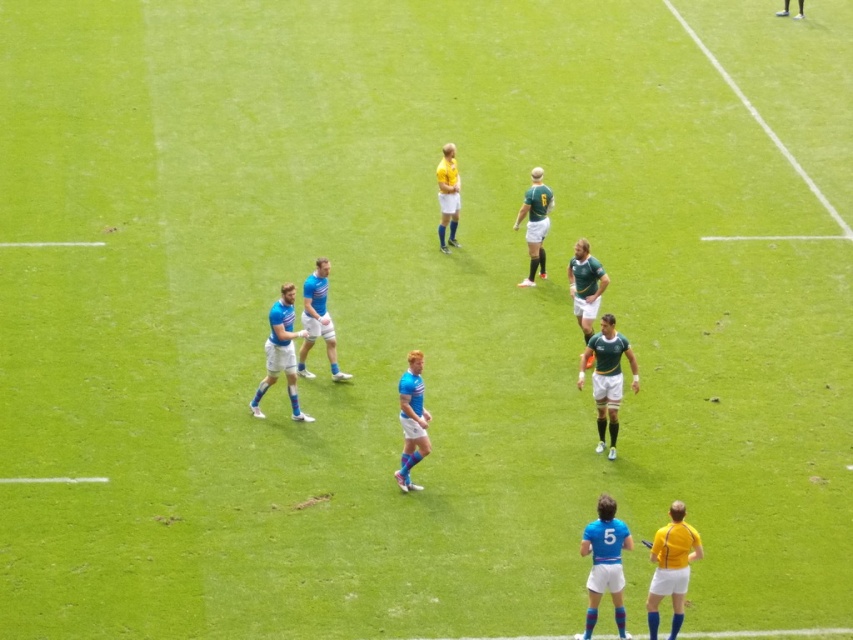
Where is `green grass at upper right`? green grass at upper right is located at coordinates (762, 124).

Where is `green grass at upper right`? green grass at upper right is located at coordinates (762, 124).

Can you confirm if green jersey at center is positioned below green matte jersey at center?

Yes.

Is point (608, 388) less distant than point (531, 244)?

Yes, point (608, 388) is in front of point (531, 244).

Find the location of a particular element. Image resolution: width=853 pixels, height=640 pixels. green jersey at center is located at coordinates (607, 378).

Is blue fabric rugby team at center bigger than yellow matte jersey at center?

Actually, blue fabric rugby team at center might be smaller than yellow matte jersey at center.

Can you confirm if blue fabric rugby team at center is positioned below yellow matte jersey at center?

Yes.

At what (x,y) coordinates should I click in order to perform the action: click on blue fabric rugby team at center. Please return your answer as a coordinate pair (x, y). Image resolution: width=853 pixels, height=640 pixels. Looking at the image, I should click on (415, 445).